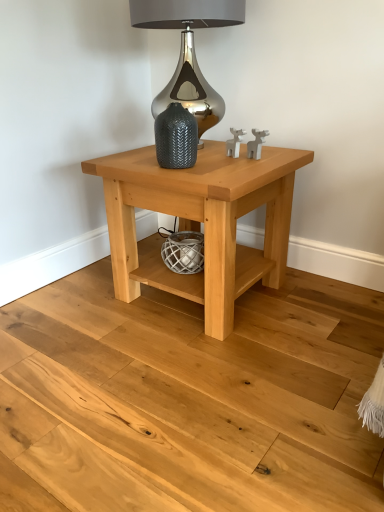
Image resolution: width=384 pixels, height=512 pixels. Identify the location of free location to the right of natural wood table at center. (323, 312).